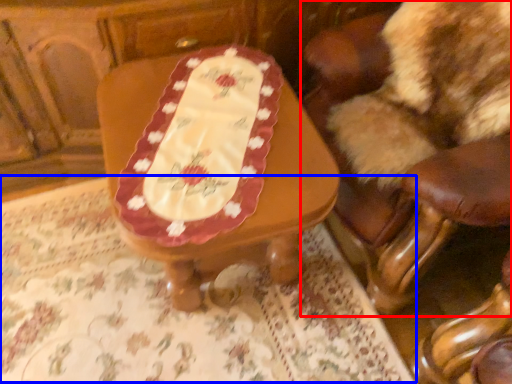
Question: Which of the following is the closest to the observer, chair (highlighted by a red box) or tablecloth (highlighted by a blue box)?

Choices:
 (A) chair
 (B) tablecloth

Answer: (A)